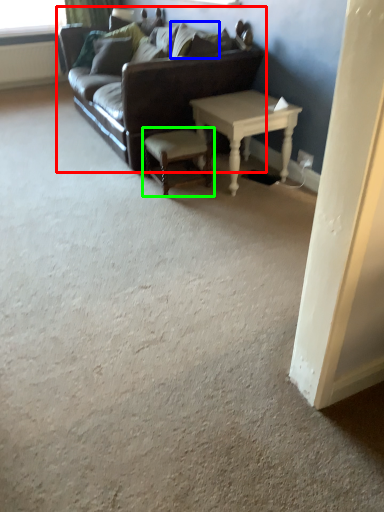
Question: Estimate the real-world distances between objects in this image. Which object is farther from studio couch (highlighted by a red box), pillow (highlighted by a blue box) or stool (highlighted by a green box)?

Choices:
 (A) pillow
 (B) stool

Answer: (A)